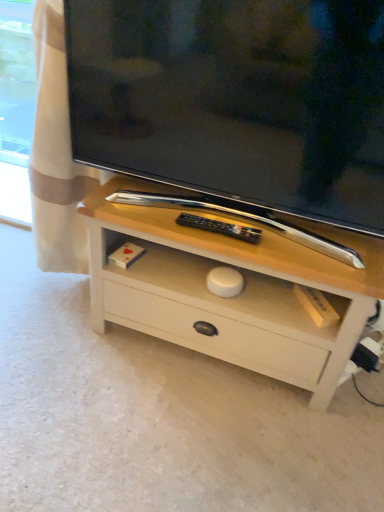
Question: In the image, is matte black tv at center positioned in front of or behind white painted wood chest of drawers at center?

Choices:
 (A) behind
 (B) front

Answer: (B)

Question: From the image's perspective, is matte black tv at center located above or below white painted wood chest of drawers at center?

Choices:
 (A) above
 (B) below

Answer: (A)

Question: Is point (193, 125) closer or farther from the camera than point (150, 259)?

Choices:
 (A) farther
 (B) closer

Answer: (B)

Question: Is white painted wood chest of drawers at center in front of or behind matte black tv at center in the image?

Choices:
 (A) behind
 (B) front

Answer: (A)

Question: From a real-world perspective, is white painted wood chest of drawers at center physically located above or below matte black tv at center?

Choices:
 (A) below
 (B) above

Answer: (A)

Question: In terms of height, does white painted wood chest of drawers at center look taller or shorter compared to matte black tv at center?

Choices:
 (A) short
 (B) tall

Answer: (A)

Question: From the image's perspective, relative to matte black tv at center, is white painted wood chest of drawers at center above or below?

Choices:
 (A) below
 (B) above

Answer: (A)